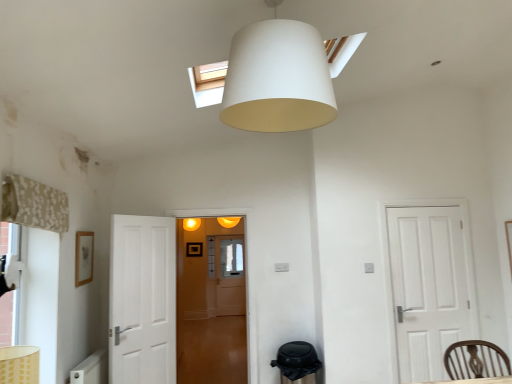
Question: From a real-world perspective, is brown wooden chair at lower right physically below white matte lampshade at upper center?

Choices:
 (A) no
 (B) yes

Answer: (B)

Question: Can you confirm if brown wooden chair at lower right is thinner than white matte lampshade at upper center?

Choices:
 (A) no
 (B) yes

Answer: (B)

Question: Considering the relative sizes of brown wooden chair at lower right and white matte lampshade at upper center in the image provided, is brown wooden chair at lower right bigger than white matte lampshade at upper center?

Choices:
 (A) yes
 (B) no

Answer: (B)

Question: From the image's perspective, does brown wooden chair at lower right appear higher than white matte lampshade at upper center?

Choices:
 (A) yes
 (B) no

Answer: (B)

Question: Considering the relative sizes of brown wooden chair at lower right and white matte lampshade at upper center in the image provided, is brown wooden chair at lower right shorter than white matte lampshade at upper center?

Choices:
 (A) yes
 (B) no

Answer: (A)

Question: Is brown wooden chair at lower right far from white matte lampshade at upper center?

Choices:
 (A) yes
 (B) no

Answer: (A)

Question: Is translucent wooden door at center oriented away from beige floral fabric curtain at left?

Choices:
 (A) no
 (B) yes

Answer: (A)

Question: Is the depth of translucent wooden door at center less than that of beige floral fabric curtain at left?

Choices:
 (A) yes
 (B) no

Answer: (B)

Question: From a real-world perspective, is translucent wooden door at center located beneath beige floral fabric curtain at left?

Choices:
 (A) yes
 (B) no

Answer: (A)

Question: Is translucent wooden door at center thinner than beige floral fabric curtain at left?

Choices:
 (A) no
 (B) yes

Answer: (A)

Question: Considering the relative positions of translucent wooden door at center and beige floral fabric curtain at left in the image provided, is translucent wooden door at center behind beige floral fabric curtain at left?

Choices:
 (A) no
 (B) yes

Answer: (B)

Question: Does translucent wooden door at center contain beige floral fabric curtain at left?

Choices:
 (A) yes
 (B) no

Answer: (B)

Question: Would you say white matte lampshade at upper center is part of beige floral fabric curtain at left's contents?

Choices:
 (A) no
 (B) yes

Answer: (A)